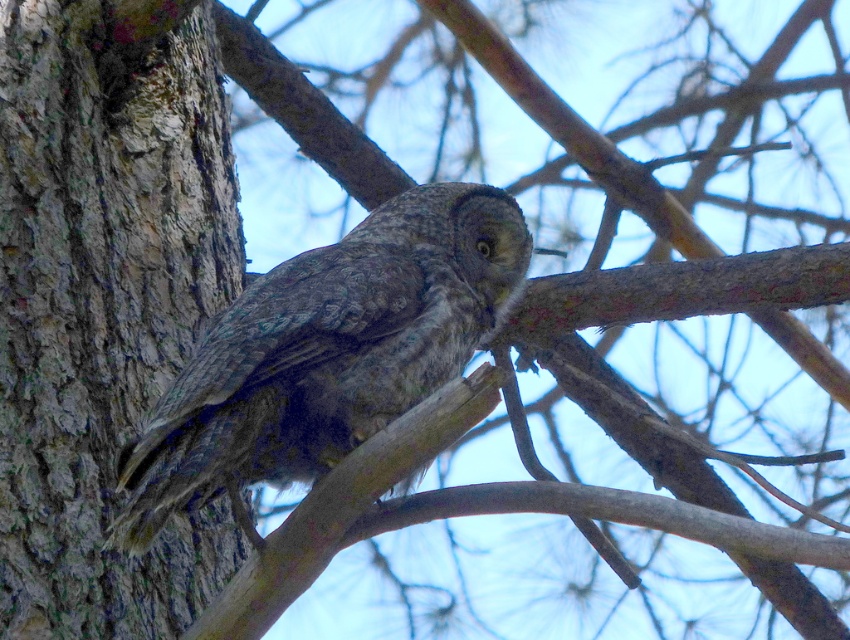
Between rough bark tree trunk at left and speckled gray owl at center, which one appears on the left side from the viewer's perspective?

rough bark tree trunk at left is more to the left.

Describe the element at coordinates (103, 314) in the screenshot. The width and height of the screenshot is (850, 640). I see `rough bark tree trunk at left` at that location.

Find the location of `rough bark tree trunk at left`. rough bark tree trunk at left is located at coordinates tap(103, 314).